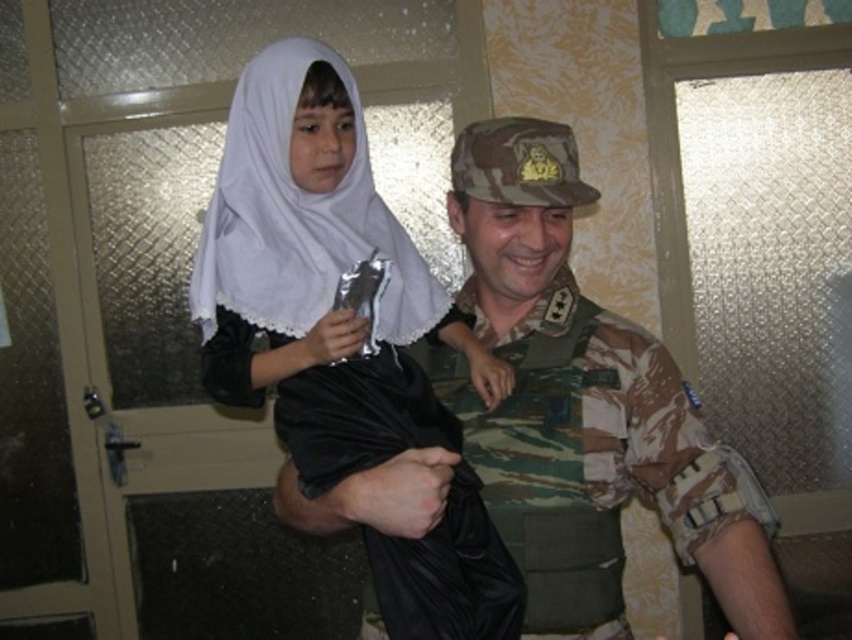
Question: Which point is farther to the camera?

Choices:
 (A) (740, 500)
 (B) (210, 273)
 (C) (265, 316)

Answer: (B)

Question: Does white satin hijab at center have a smaller size compared to camouflage uniform at center?

Choices:
 (A) no
 (B) yes

Answer: (B)

Question: Can you confirm if white satin hijab at center is positioned to the right of camouflage uniform at center?

Choices:
 (A) no
 (B) yes

Answer: (A)

Question: Observing the image, what is the correct spatial positioning of camouflage uniform at center in reference to white sheer veil at upper left?

Choices:
 (A) right
 (B) left

Answer: (A)

Question: Which object is farther from the camera taking this photo?

Choices:
 (A) camouflage uniform at center
 (B) white satin hijab at center
 (C) white sheer veil at upper left

Answer: (C)

Question: Which object is positioned farthest from the white satin hijab at center?

Choices:
 (A) camouflage uniform at center
 (B) white sheer veil at upper left

Answer: (A)